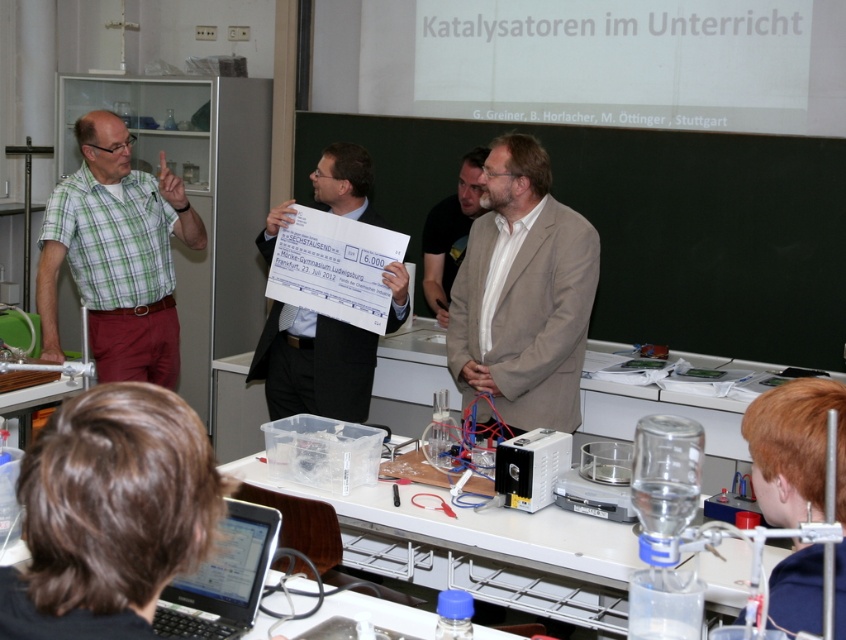
Who is positioned more to the left, blackboard at center or beige fabric suit at center?

From the viewer's perspective, beige fabric suit at center appears more on the left side.

Is blackboard at center above beige fabric suit at center?

Yes, blackboard at center is above beige fabric suit at center.

Locate an element on the screen. blackboard at center is located at coordinates (652, 225).

What are the coordinates of `blackboard at center` in the screenshot? It's located at (652, 225).

Between green checkered shirt at left and white paper check at center, which one has more height?

With more height is green checkered shirt at left.

Can you confirm if green checkered shirt at left is shorter than white paper check at center?

In fact, green checkered shirt at left may be taller than white paper check at center.

Does point (168, 186) come farther from viewer compared to point (350, 148)?

Yes, it is.

The width and height of the screenshot is (846, 640). I want to click on green checkered shirt at left, so click(116, 256).

Is point (562, 413) closer to camera compared to point (92, 332)?

That is True.

Between beige fabric suit at center and green checkered shirt at left, which one is positioned higher?

green checkered shirt at left

Find the location of `beige fabric suit at center`. beige fabric suit at center is located at coordinates (523, 292).